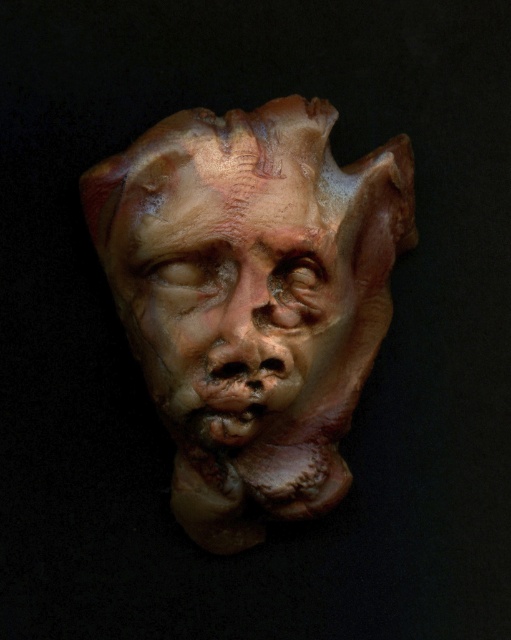
Question: Does matte clay mask at center appear under matte brown mask at center?

Choices:
 (A) yes
 (B) no

Answer: (A)

Question: Which of the following is the farthest from the observer?

Choices:
 (A) matte brown mask at center
 (B) matte clay mask at center

Answer: (B)

Question: Which point appears farthest from the camera in this image?

Choices:
 (A) (234, 198)
 (B) (174, 326)

Answer: (B)

Question: Among these objects, which one is nearest to the camera?

Choices:
 (A) matte brown mask at center
 (B) matte clay mask at center

Answer: (A)

Question: Is matte clay mask at center to the right of matte brown mask at center from the viewer's perspective?

Choices:
 (A) no
 (B) yes

Answer: (B)

Question: Can you confirm if matte clay mask at center is thinner than matte brown mask at center?

Choices:
 (A) yes
 (B) no

Answer: (B)